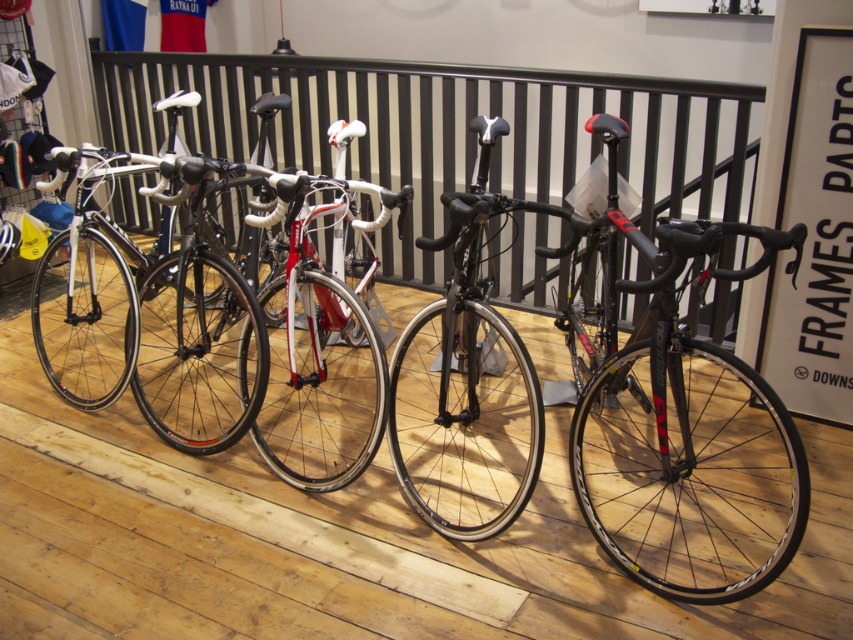
You are standing at the entrance of the bike shop and see two points marked on the floor. The first point is at coordinate point (694, 371) and the second is at point (299, 314). If you want to walk from the entrance to the point that is closer to the entrance, which point should you head towards?

Point (694, 371) is in front of point (299, 314), so the point closer to the entrance is point (694, 371). You should head towards point (694, 371).

You are a customer in the bike shop and want to take a closer look at both the shiny red bike at center and the matte black bike at center. Which bike do you need to walk around first to see the one behind it?

The shiny red bike at center is in front of the matte black bike at center, so you need to walk around the shiny red bike at center first to see the matte black bike at center behind it.

You are a customer in the bike shop and want to take a closer look at the shiny black bike at center. If you walk 1.5 meters towards the bike, will you be able to touch it?

The shiny black bike at center is initially 1.63 meters away. After moving 1.5 meters closer, you would be 0.13 meters away, so yes, you can touch it.